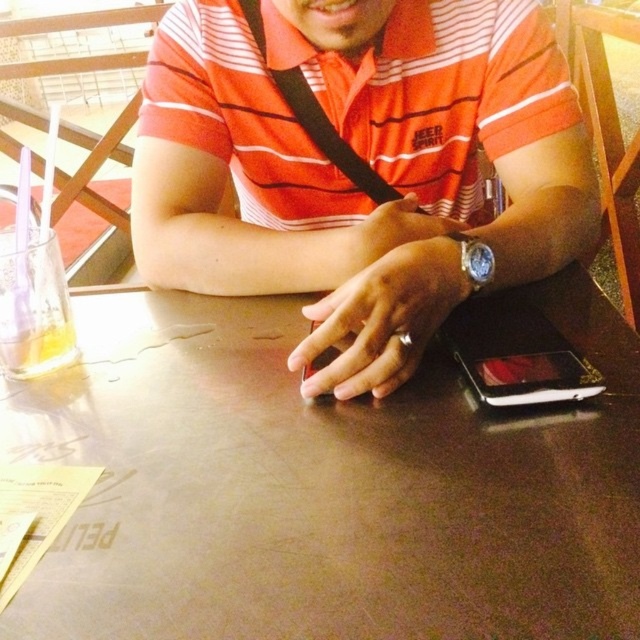
Who is positioned more to the right, metallic brown table at center or matte black phone at center?

Positioned to the right is matte black phone at center.

Between metallic brown table at center and matte black phone at center, which one has less height?

metallic brown table at center

Is point (269, 326) positioned in front of point (234, 182)?

Yes, it is.

Locate an element on the screen. This screenshot has height=640, width=640. metallic brown table at center is located at coordinates (324, 486).

Can you confirm if matte black phone at center is smaller than black matte smartphone at center?

Actually, matte black phone at center might be larger than black matte smartphone at center.

Is matte black phone at center in front of black matte smartphone at center?

That is True.

Where is `matte black phone at center`? The image size is (640, 640). matte black phone at center is located at coordinates click(x=358, y=163).

Can you confirm if matte black phone at center is thinner than black plastic phone at lower right?

No.

Is point (349, 109) positioned in front of point (470, 353)?

No, (349, 109) is behind (470, 353).

You are a GUI agent. You are given a task and a screenshot of the screen. Output one action in this format:
    pyautogui.click(x=<x>, y=<y>)
    Task: Click on the matte black phone at center
    This screenshot has height=640, width=640.
    Given the screenshot: What is the action you would take?
    pyautogui.click(x=358, y=163)